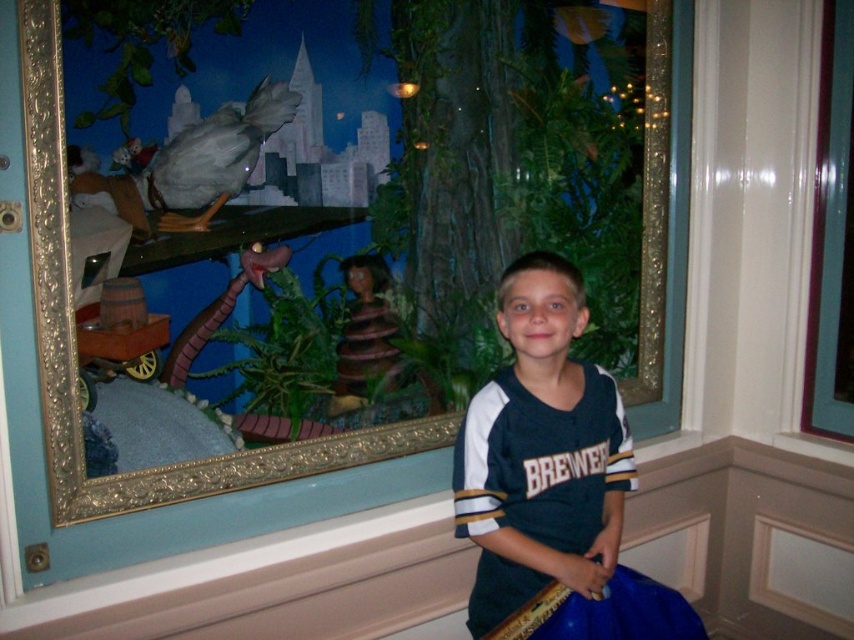
You are a photographer standing in front of the dark blue jersey at center. You want to take a closeup shot without getting too close. Your camera has a maximum zoom of 2x. The recommended distance for a closeup is 1.5 meters. Can you take the photo from your current position?

The dark blue jersey at center and the viewer are 1.57 meters apart, which is slightly more than the recommended 1.5 meters for a closeup. Since your camera can zoom 2x, you can adjust the zoom to capture a closeup without moving closer.

You are a photographer setting up a shot of the boy in the scene. You need to ensure that the dark blue jersey at center and the transparent glass window at upper right are both visible in the frame. Which object should you adjust your focus on first to ensure both are in focus, considering their sizes?

The dark blue jersey at center is shorter than the transparent glass window at upper right, so you should focus on the transparent glass window at upper right first since it is taller and requires more attention to capture its full height in the frame.